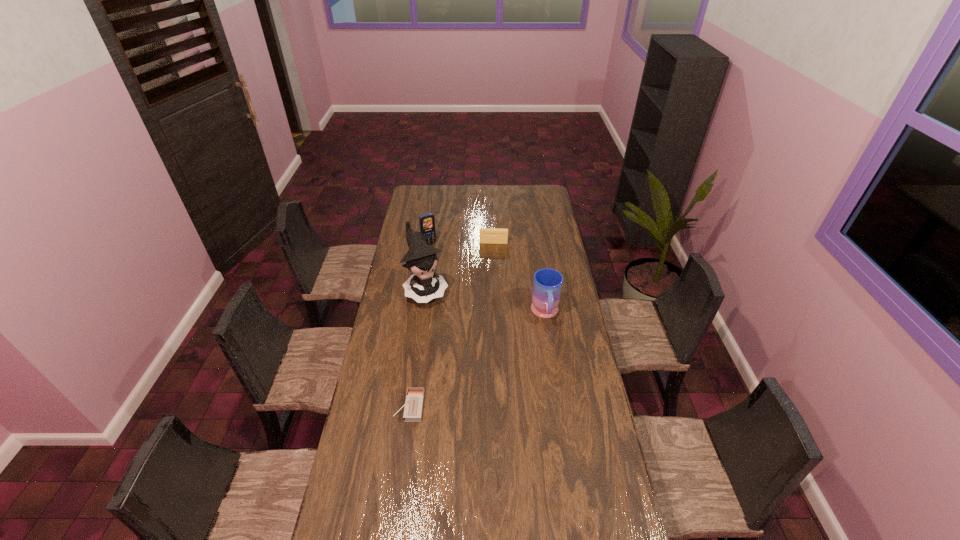
I want to click on vacant spot on the desktop that is between the shortest object and the rightmost object and is positioned at the front of the second object from right to left with spools, so click(490, 351).

This screenshot has width=960, height=540. I want to click on free space on the desktop that is between the nearest object and the rightmost object and is positioned at the face of the tallest object, so click(x=469, y=365).

This screenshot has width=960, height=540. I want to click on vacant spot on the desktop that is between the matchbox and the mug and is positioned on the screen of the cellular telephone, so click(x=496, y=347).